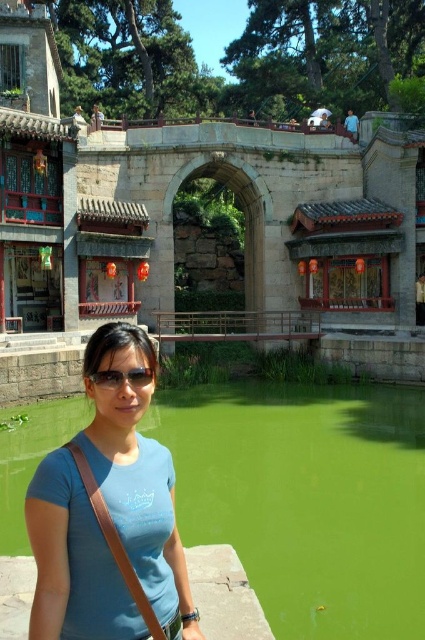
You are standing at the point labeled point (116, 380) in the garden. You want to walk towards the point labeled point (17, 84). Which direction should you face to walk directly towards it?

To walk directly towards point (17, 84) from point (116, 380), you should face north because point (17, 84) is behind point (116, 380).

You are planning to take a photo of the stone archway at center from where you are standing. Considering the distance, would you need a zoom lens to capture the entire structure in your shot?

The stone archway at center is 178.68 feet away from the viewer. Since this distance is quite far, using a zoom lens would be necessary to ensure the entire structure is captured clearly in the photo.

You are a visitor in the garden and want to take a photo of the stone archway at center without the black plastic goggles at center appearing in the frame. How can you adjust your camera angle to achieve this?

Since the stone archway at center is located above the black plastic goggles at center, you can angle your camera upwards to focus on the stone archway at center while avoiding the black plastic goggles at center below it.